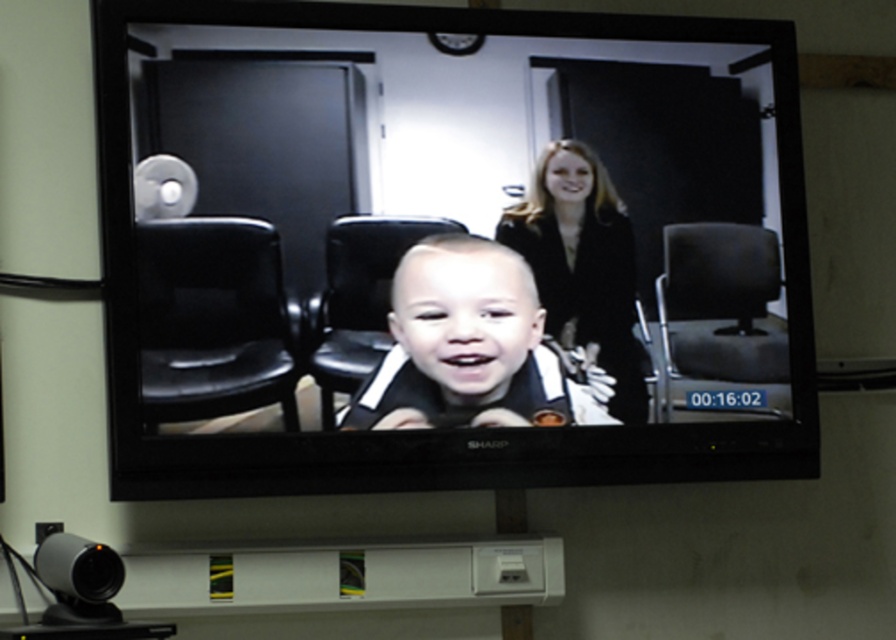
Question: Can you confirm if black leather chair at left is wider than black smooth suit at upper center?

Choices:
 (A) no
 (B) yes

Answer: (A)

Question: Is matte black monitor at center wider than black leather swivel chair at right?

Choices:
 (A) yes
 (B) no

Answer: (A)

Question: Where is smooth skin baby at center located in relation to black smooth suit at upper center in the image?

Choices:
 (A) below
 (B) above

Answer: (A)

Question: Which of the following is the closest to the observer?

Choices:
 (A) (125, 211)
 (B) (224, 294)

Answer: (A)

Question: Which object is closer to the camera taking this photo?

Choices:
 (A) black leather chair at center
 (B) black leather chair at left
 (C) matte black monitor at center
 (D) black leather swivel chair at right

Answer: (C)

Question: Among these objects, which one is farthest from the camera?

Choices:
 (A) black leather swivel chair at right
 (B) matte black monitor at center

Answer: (A)